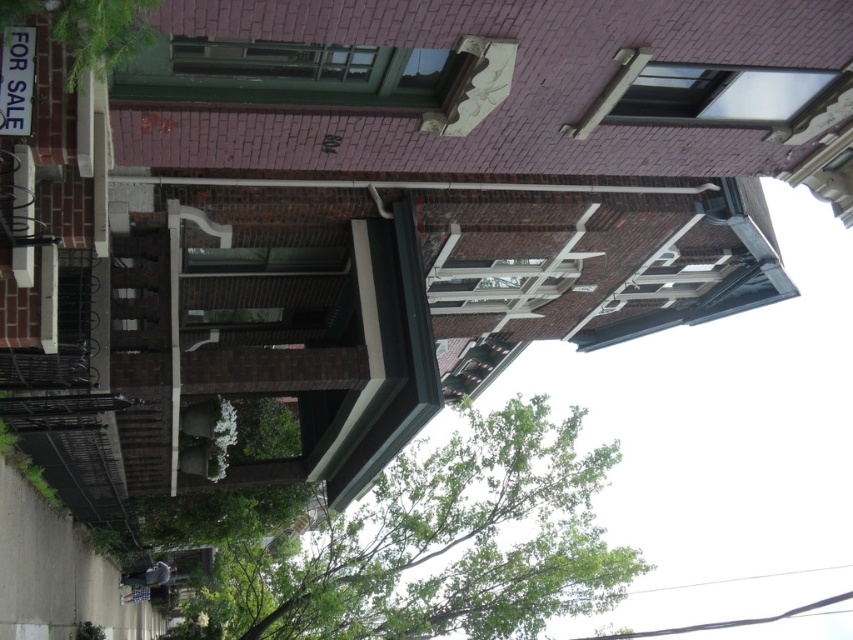
Question: Can you confirm if green leafy tree at lower center is thinner than green leafy tree at upper left?

Choices:
 (A) yes
 (B) no

Answer: (B)

Question: Which point is closer to the camera?

Choices:
 (A) (537, 561)
 (B) (112, 38)

Answer: (B)

Question: From the image, what is the correct spatial relationship of green leafy tree at lower center in relation to green leafy tree at upper left?

Choices:
 (A) left
 (B) right

Answer: (A)

Question: Can you confirm if green leafy tree at lower center is positioned above green leafy tree at upper left?

Choices:
 (A) yes
 (B) no

Answer: (B)

Question: Among these points, which one is farthest from the camera?

Choices:
 (A) (544, 541)
 (B) (119, 33)

Answer: (A)

Question: Among these objects, which one is farthest from the camera?

Choices:
 (A) green leafy tree at upper left
 (B) green leafy tree at lower center

Answer: (B)